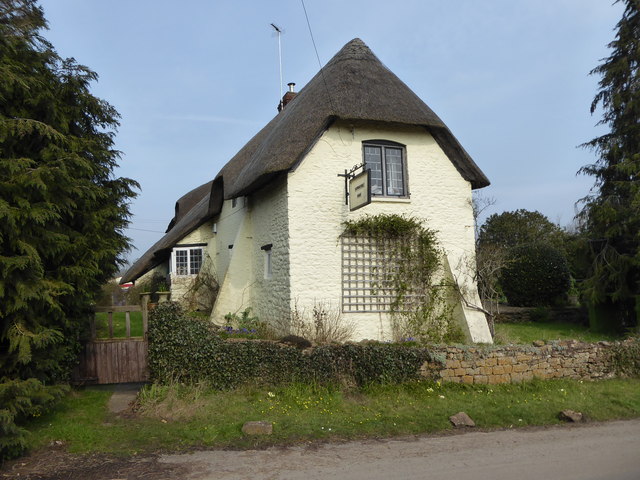
The width and height of the screenshot is (640, 480). In order to click on window in this screenshot , I will do `click(390, 171)`, `click(194, 263)`.